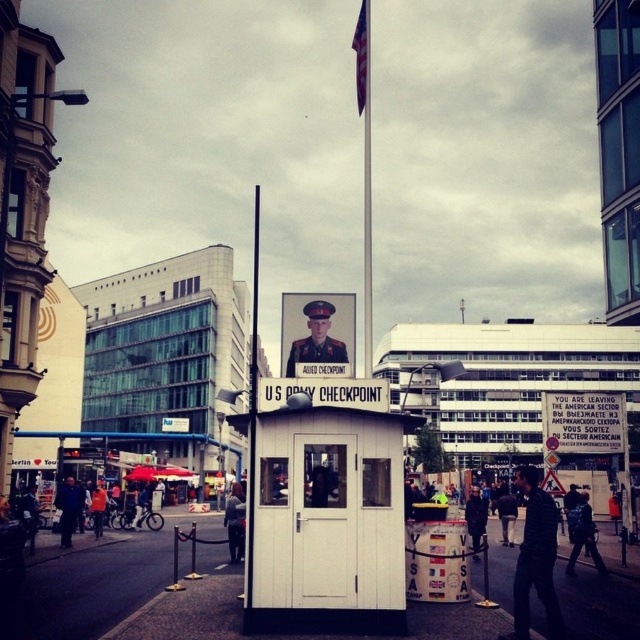
Question: Is metallic flag pole at center bigger than dark blue jeans at center?

Choices:
 (A) no
 (B) yes

Answer: (B)

Question: Estimate the real-world distances between objects in this image. Which object is farther from the white fabric flag at upper center?

Choices:
 (A) uniformed officer at center
 (B) dark blue shirt at center
 (C) metallic pole at center
 (D) metallic flag pole at center

Answer: (B)

Question: Which of these objects is positioned closest to the dark blue jeans at center?

Choices:
 (A) white fabric flag at upper center
 (B) uniformed officer at center
 (C) dark blue shirt at center
 (D) metallic pole at center

Answer: (C)

Question: Which of these objects is positioned closest to the metallic pole at center?

Choices:
 (A) metallic flag pole at center
 (B) white fabric flag at upper center
 (C) dark blue shirt at center

Answer: (A)

Question: From the image, what is the correct spatial relationship of dark blue shirt at center in relation to metallic pole at center?

Choices:
 (A) right
 (B) left

Answer: (A)

Question: From the image, what is the correct spatial relationship of metallic flag pole at center in relation to uniformed officer at center?

Choices:
 (A) above
 (B) below

Answer: (A)